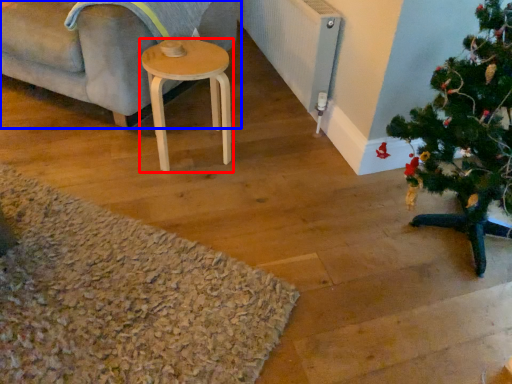
Question: Which object appears closest to the camera in this image, stool (highlighted by a red box) or studio couch (highlighted by a blue box)?

Choices:
 (A) stool
 (B) studio couch

Answer: (B)